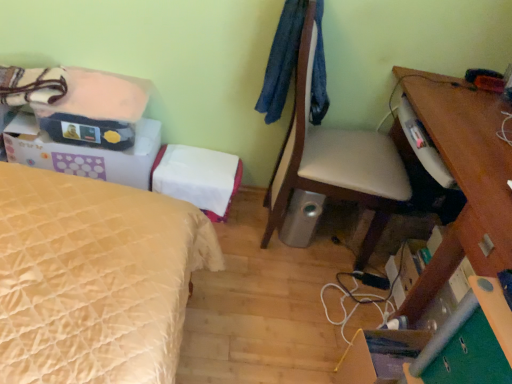
At what (x,y) coordinates should I click in order to perform the action: click on free space in front of silver metallic speaker at lower center. Please return your answer as a coordinate pair (x, y). The image size is (512, 384). Looking at the image, I should click on (x=289, y=263).